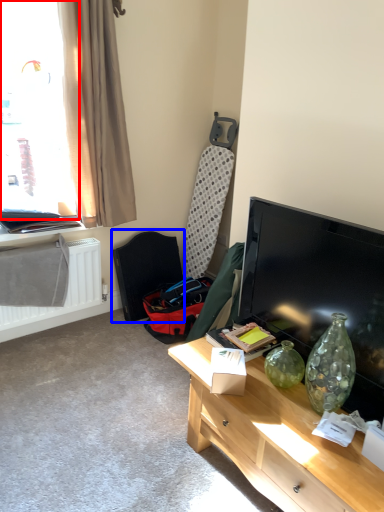
Question: Which of the following is the farthest to the observer, window (highlighted by a red box) or swivel chair (highlighted by a blue box)?

Choices:
 (A) window
 (B) swivel chair

Answer: (B)